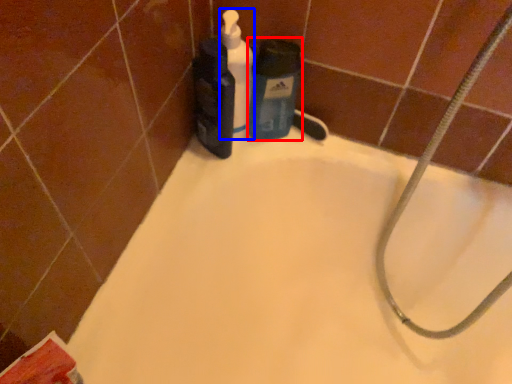
Question: Among these objects, which one is nearest to the camera, cleaning product (highlighted by a red box) or cleaning product (highlighted by a blue box)?

Choices:
 (A) cleaning product
 (B) cleaning product

Answer: (B)